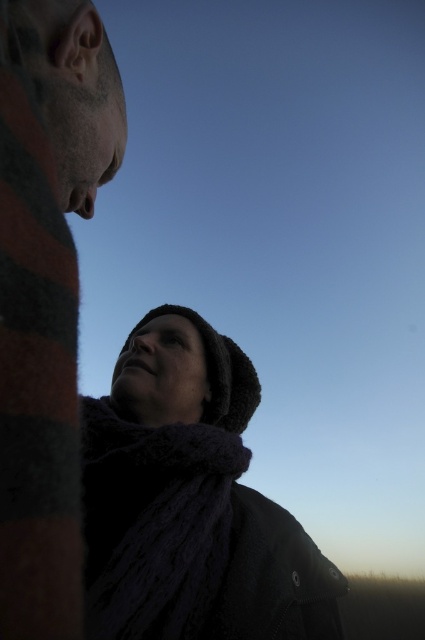
Question: Is striped wool scarf at left above dark woolen scarf at lower center?

Choices:
 (A) no
 (B) yes

Answer: (B)

Question: Which point is farther to the camera?

Choices:
 (A) (209, 488)
 (B) (141, 484)
 (C) (53, 204)

Answer: (A)

Question: From the image, what is the correct spatial relationship of striped wool scarf at left in relation to dark woolen scarf at lower center?

Choices:
 (A) right
 (B) left

Answer: (B)

Question: Which is farther from the dark woolen scarf at lower center?

Choices:
 (A) knitted wool scarf at lower left
 (B) striped wool scarf at left

Answer: (B)

Question: Can you confirm if knitted wool scarf at lower left is smaller than dark woolen scarf at lower center?

Choices:
 (A) yes
 (B) no

Answer: (B)

Question: Which of these objects is positioned closest to the dark woolen scarf at lower center?

Choices:
 (A) knitted wool scarf at lower left
 (B) striped wool scarf at left

Answer: (A)